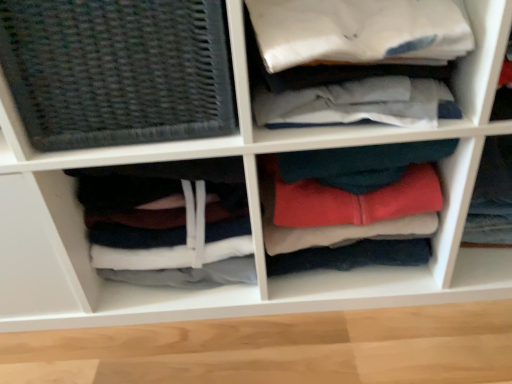
Question: From the image's perspective, relative to dark gray fabric at lower left, which ranks as the 1th clothing in left-to-right order, is red fleece hoodie at center, marked as the 1th clothing in a right-to-left arrangement, above or below?

Choices:
 (A) above
 (B) below

Answer: (A)

Question: Is point (479, 210) closer or farther from the camera than point (160, 220)?

Choices:
 (A) closer
 (B) farther

Answer: (B)

Question: Considering the real-world distances, which object is farthest from the red fleece hoodie at center, the third clothing in the left-to-right sequence?

Choices:
 (A) dark gray woven mat at left
 (B) soft fleece hoodie at center, which is the second clothing from right to left
 (C) dark gray fabric at lower left, the 3th clothing viewed from the right

Answer: (A)

Question: Which is nearer to the soft fleece hoodie at center, which is the second clothing from right to left?

Choices:
 (A) dark gray woven mat at left
 (B) dark gray fabric at lower left, the 3th clothing viewed from the right
 (C) red fleece hoodie at center, marked as the 1th clothing in a right-to-left arrangement

Answer: (B)